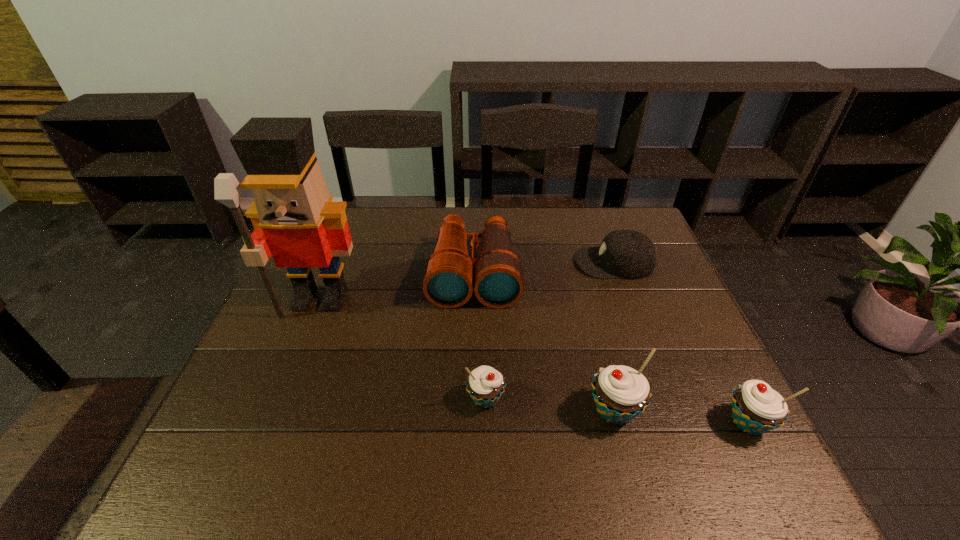
All cupcakes are currently evenly spaced. To continue this pattern, where would you add another cupcake on the left? Please point out a vacant spot. Please provide its 2D coordinates. Your answer should be formatted as a tuple, i.e. [(x, y)], where the tuple contains the x and y coordinates of a point satisfying the conditions above.

[(363, 388)]